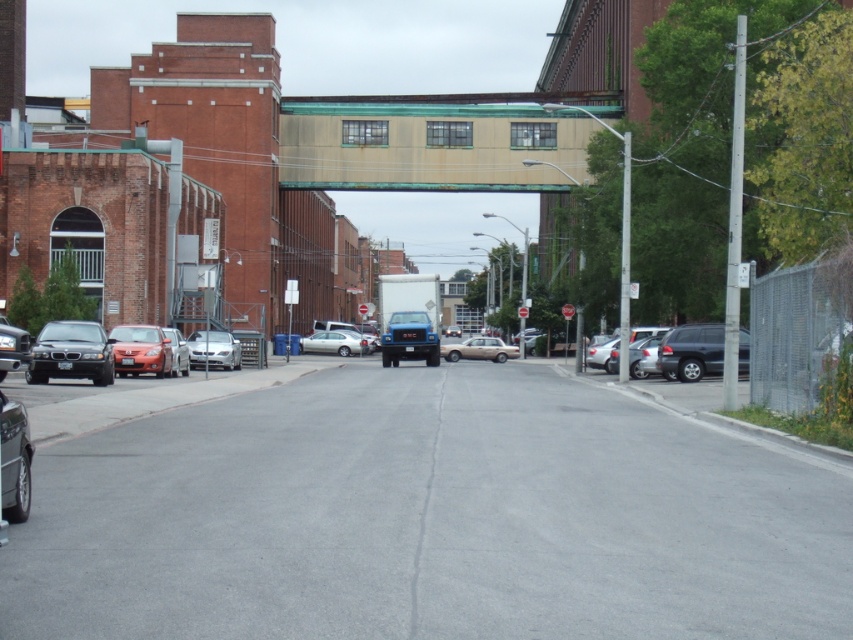
Question: Which point appears farthest from the camera in this image?

Choices:
 (A) (471, 340)
 (B) (611, 371)
 (C) (22, 348)
 (D) (119, 348)

Answer: (A)

Question: Observing the image, what is the correct spatial positioning of shiny black suv at right in reference to gold metallic sedan at center?

Choices:
 (A) below
 (B) above

Answer: (B)

Question: Considering the relative positions of silver metallic sedan at center and silver metallic sedan at left in the image provided, where is silver metallic sedan at center located with respect to silver metallic sedan at left?

Choices:
 (A) below
 (B) above

Answer: (A)

Question: Considering the real-world distances, which object is farthest from the beige concrete bridge at center?

Choices:
 (A) matte black car at left
 (B) shiny black sedan at left
 (C) shiny black suv at right
 (D) silver metallic sedan at left

Answer: (A)

Question: Is matte black car at left in front of silver metallic sedan at right?

Choices:
 (A) no
 (B) yes

Answer: (B)

Question: Which point is closer to the camera?

Choices:
 (A) (109, 342)
 (B) (221, 364)

Answer: (A)